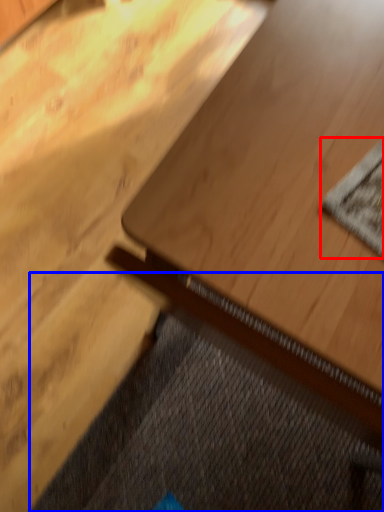
Question: Among these objects, which one is nearest to the camera, mat (highlighted by a red box) or doormat (highlighted by a blue box)?

Choices:
 (A) mat
 (B) doormat

Answer: (A)